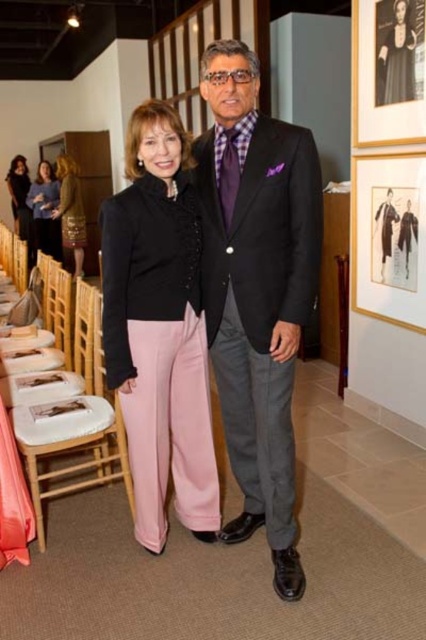
You are a photographer setting up for an event. You need to decide which garment to focus on based on their visual presence. Given that the matte black blazer at center and the gold metallic dress at left are in your frame, which one should you prioritize capturing due to its larger visual impact?

The gold metallic dress at left has a larger visual impact because it occupies more space in the frame than the matte black blazer at center, so you should prioritize capturing the gold metallic dress at left.

You are organizing a photo shoot in the gallery and need to ensure that the matte black suit at center and the wooden picture frame at upper right are both visible in the frame. Given their sizes, which object will require more horizontal space to capture fully in the photo?

The matte black suit at center requires more horizontal space because its width surpasses that of the wooden picture frame at upper right.

You are standing in the center of the room and want to greet the person wearing the matte black suit at center. In which direction should you move to reach them?

The matte black suit at center is located at point coordinates 0.453 on the x axis and 0.603 on the y axis. Since you are at the center of the room, which is typically at coordinates (213, 320), you should move slightly to the left and forward to reach the matte black suit at center.